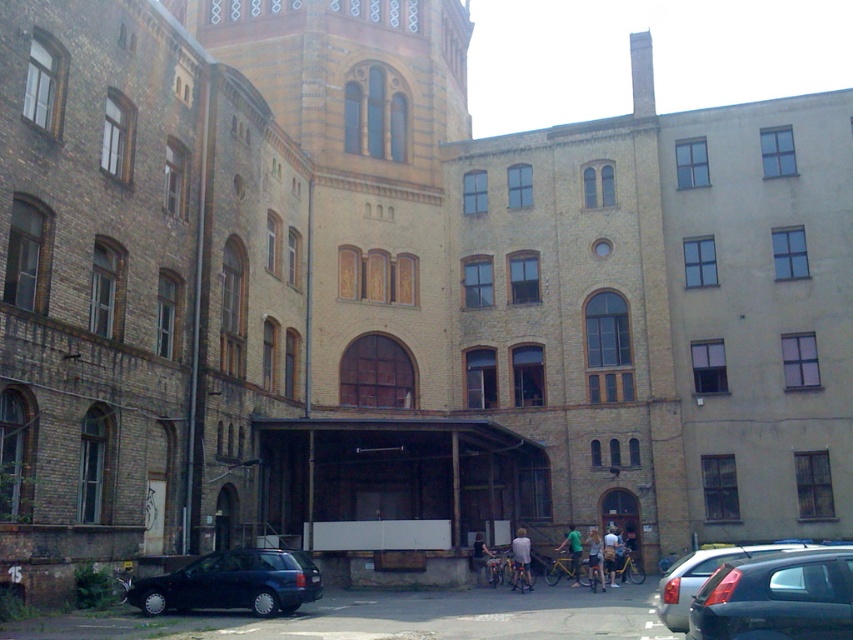
How far apart are light blue fabric shirt at center and light blue jeans at center?

light blue fabric shirt at center and light blue jeans at center are 13.27 feet apart.

Is the position of light blue fabric shirt at center less distant than that of light blue jeans at center?

No.

Is point (521, 538) positioned before point (601, 566)?

No, (521, 538) is further to viewer.

At what (x,y) coordinates should I click in order to perform the action: click on light blue fabric shirt at center. Please return your answer as a coordinate pair (x, y). This screenshot has height=640, width=853. Looking at the image, I should click on (521, 557).

Where is `light blue fabric shirt at center`? The image size is (853, 640). light blue fabric shirt at center is located at coordinates (521, 557).

Is point (525, 576) positioned behind point (570, 550)?

No.

Where is `light blue fabric shirt at center`? This screenshot has height=640, width=853. light blue fabric shirt at center is located at coordinates (521, 557).

Which is in front, point (595, 547) or point (480, 538)?

Point (595, 547) is in front.

Is point (589, 547) farther from camera compared to point (473, 554)?

Yes, point (589, 547) is farther from viewer.

Identify the location of light blue jeans at center. The image size is (853, 640). (595, 557).